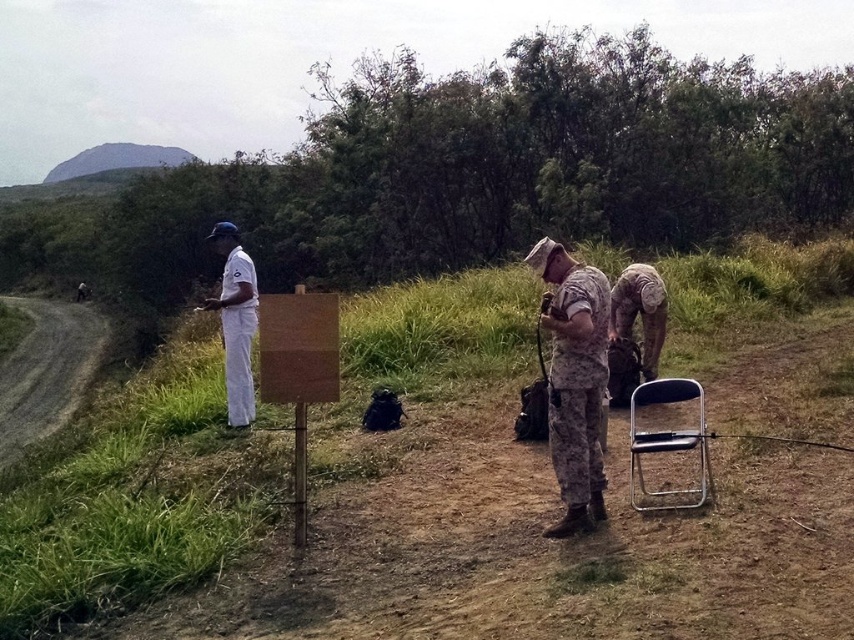
Find the location of a particular element. The height and width of the screenshot is (640, 854). brown dirt field at center is located at coordinates (537, 552).

Between brown dirt field at center and metallic silver folding chair at lower right, which one has more height?

Standing taller between the two is metallic silver folding chair at lower right.

This screenshot has height=640, width=854. I want to click on brown dirt field at center, so click(x=537, y=552).

Find the location of a particular element. The width and height of the screenshot is (854, 640). brown dirt field at center is located at coordinates (537, 552).

Does point (632, 490) come closer to viewer compared to point (636, 262)?

That is True.

The height and width of the screenshot is (640, 854). I want to click on metallic silver folding chair at lower right, so click(668, 442).

Who is higher up, camouflage fabric uniform at center or camouflage fabric backpack at center?

camouflage fabric backpack at center is higher up.

Based on the photo, who is more distant from viewer, (545, 532) or (642, 332)?

The point (642, 332) is more distant.

Is point (563, 413) closer to camera compared to point (645, 364)?

Yes, point (563, 413) is in front of point (645, 364).

Locate an element on the screen. camouflage fabric uniform at center is located at coordinates (574, 380).